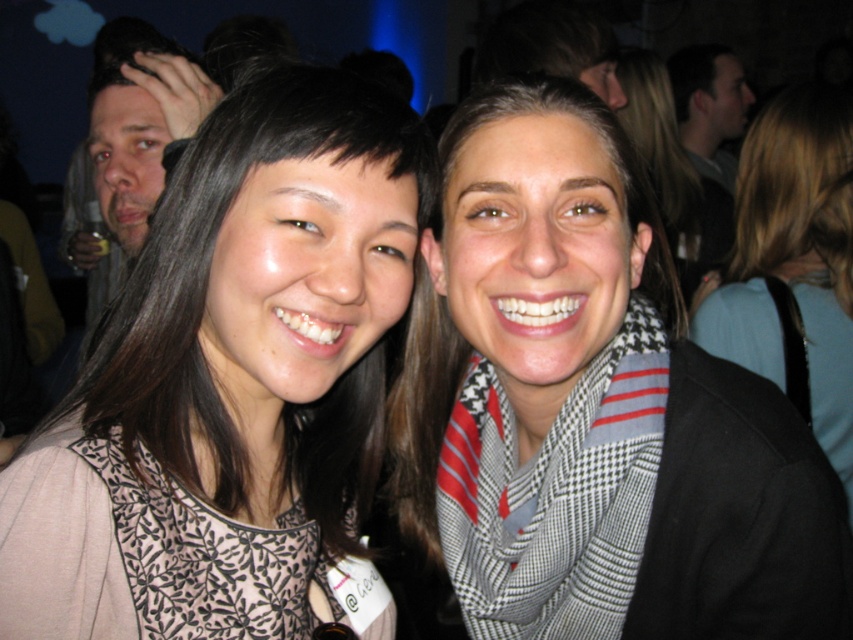
Is matte floral dress at center wider than light blue scarf at center?

In fact, matte floral dress at center might be narrower than light blue scarf at center.

Is matte floral dress at center in front of light blue scarf at center?

Yes, matte floral dress at center is in front of light blue scarf at center.

Image resolution: width=853 pixels, height=640 pixels. In order to click on matte floral dress at center in this screenshot , I will do `click(227, 381)`.

Identify the location of matte floral dress at center. tap(227, 381).

Which of these two, light blue scarf at center or matte black hair at left, stands shorter?

matte black hair at left is shorter.

Who is more forward, (756, 273) or (163, 173)?

Positioned in front is point (163, 173).

Between point (842, 90) and point (126, 209), which one is positioned in front?

Point (126, 209) is in front.

Locate an element on the screen. Image resolution: width=853 pixels, height=640 pixels. light blue scarf at center is located at coordinates pos(793,262).

Can you confirm if light blue scarf at center is positioned above dark hair at upper right?

Incorrect, light blue scarf at center is not positioned above dark hair at upper right.

Is light blue scarf at center smaller than dark hair at upper right?

Indeed, light blue scarf at center has a smaller size compared to dark hair at upper right.

Who is more distant from viewer, (741, 205) or (706, 148)?

The point (706, 148) is more distant.

I want to click on light blue scarf at center, so click(793, 262).